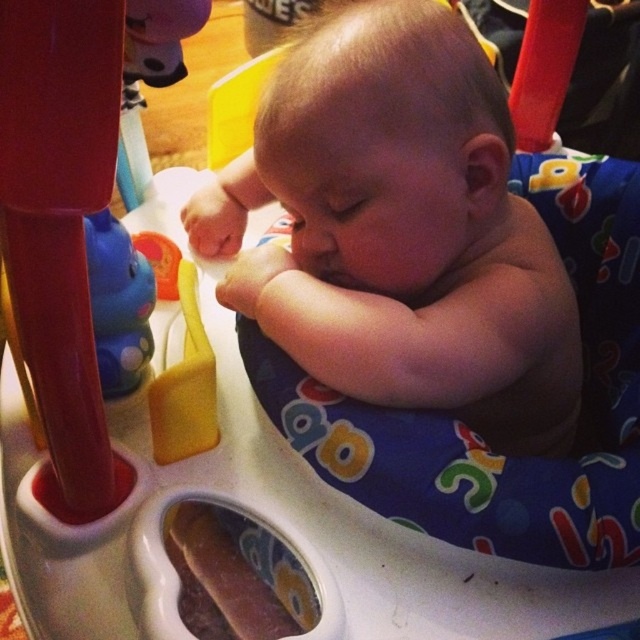
Question: Which point appears closest to the camera in this image?

Choices:
 (A) (157, 285)
 (B) (205, 256)

Answer: (A)

Question: Which object appears farthest from the camera in this image?

Choices:
 (A) rubberized plastic toy at left
 (B) blue rubber toy at left

Answer: (A)

Question: Can you confirm if smooth skin baby at center is wider than rubberized plastic toy at left?

Choices:
 (A) yes
 (B) no

Answer: (A)

Question: Among these objects, which one is nearest to the camera?

Choices:
 (A) smooth skin baby at center
 (B) rubberized plastic toy at left

Answer: (A)

Question: Does smooth skin baby at center lie behind rubberized plastic toy at left?

Choices:
 (A) yes
 (B) no

Answer: (B)

Question: Can you confirm if smooth skin baby at center is positioned below rubberized plastic toy at left?

Choices:
 (A) no
 (B) yes

Answer: (B)